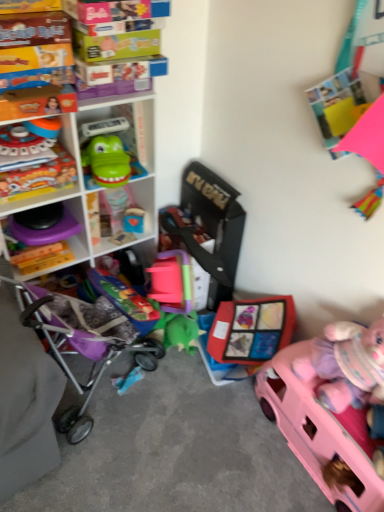
Where is `vacant region to the right of purple fabric baby carriage at lower left`? The image size is (384, 512). vacant region to the right of purple fabric baby carriage at lower left is located at coordinates (184, 421).